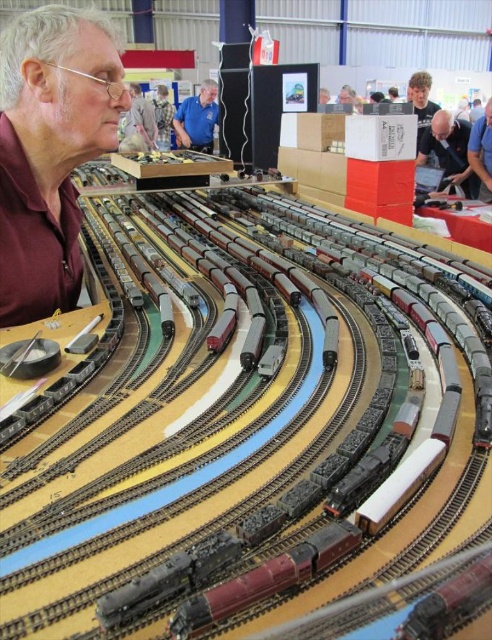
Is matte brown shirt at left smaller than blue shirt at upper right?

Correct, matte brown shirt at left occupies less space than blue shirt at upper right.

The image size is (492, 640). What do you see at coordinates (51, 148) in the screenshot?
I see `matte brown shirt at left` at bounding box center [51, 148].

Which is behind, point (39, 317) or point (483, 140)?

The point (483, 140) is behind.

Where is `matte brown shirt at left`? matte brown shirt at left is located at coordinates (51, 148).

Between blonde hair at upper right and camouflage fabric shirt at center, which one is positioned lower?

blonde hair at upper right is below.

Does point (413, 100) come closer to viewer compared to point (166, 125)?

Yes, point (413, 100) is in front of point (166, 125).

Find the location of `blonde hair at upper right`. blonde hair at upper right is located at coordinates (421, 100).

Is point (480, 144) closer to viewer compared to point (158, 141)?

Yes, point (480, 144) is in front of point (158, 141).

Is blue shirt at upper right positioned before camouflage fabric shirt at center?

Yes.

Describe the element at coordinates (482, 150) in the screenshot. I see `blue shirt at upper right` at that location.

Identify the location of blue shirt at upper right. This screenshot has width=492, height=640. (482, 150).